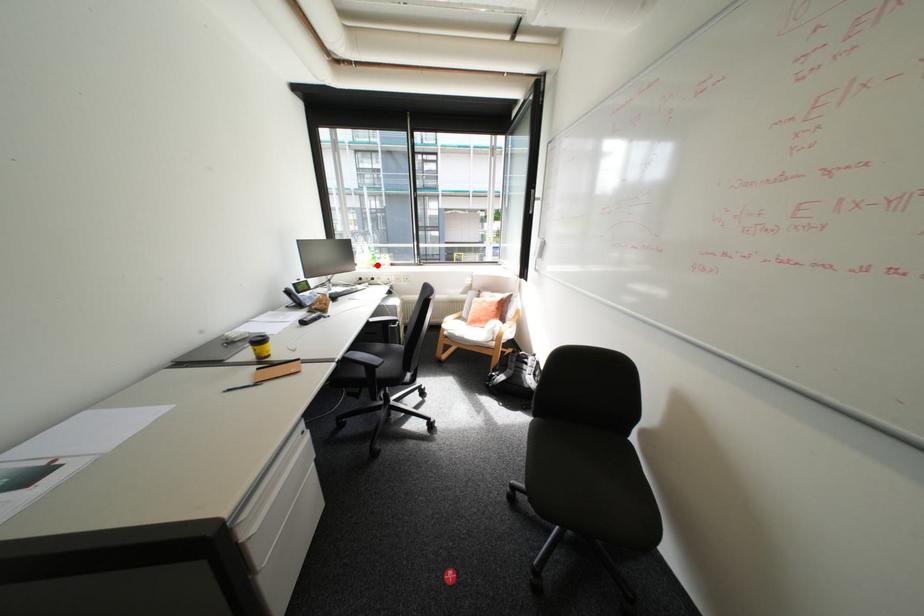
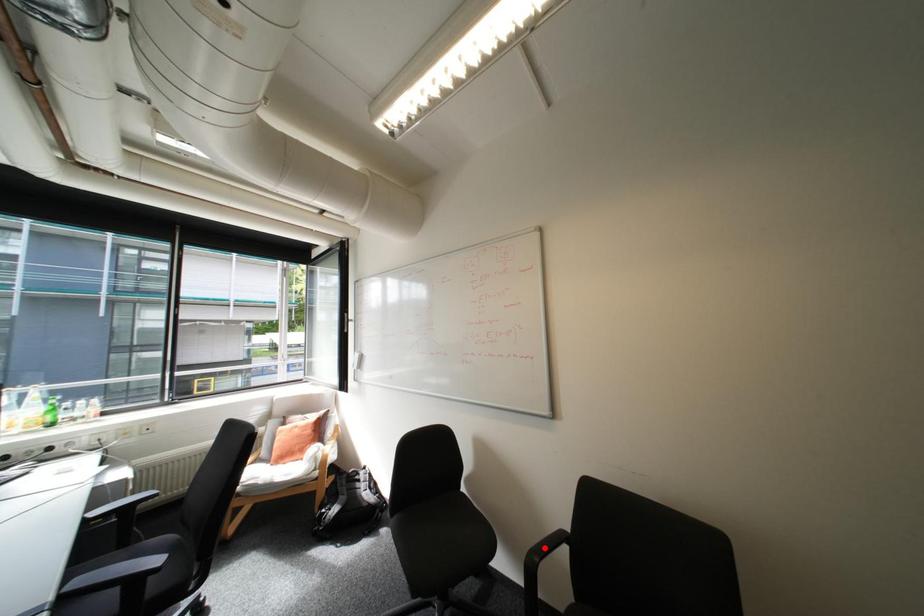
I am providing you with two images of the same scene from different viewpoints. A red point is marked on the first image and another point is marked on the second image. Does the point marked in image1 correspond to the same location as the one in image2?

No